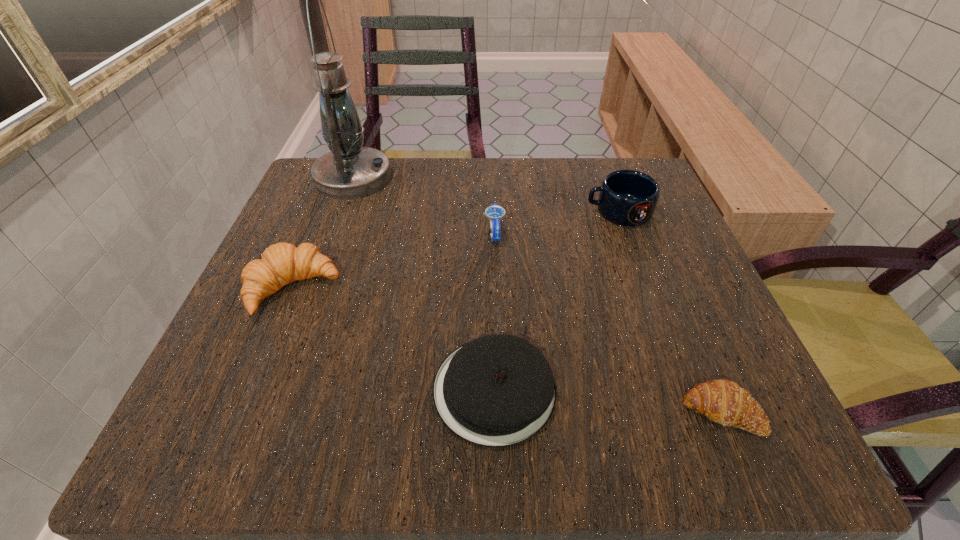
Locate an element on the screen. This screenshot has height=540, width=960. crescent roll located at the near edge is located at coordinates (722, 401).

Identify the location of oil lamp at the left edge. Image resolution: width=960 pixels, height=540 pixels. (350, 171).

The width and height of the screenshot is (960, 540). I want to click on crescent roll that is at the left edge, so click(x=282, y=263).

Where is `mug present at the right edge`? mug present at the right edge is located at coordinates point(627,197).

The height and width of the screenshot is (540, 960). What are the coordinates of `crescent roll that is at the right edge` in the screenshot? It's located at (722, 401).

The image size is (960, 540). Identify the location of object situated at the far left corner. (350, 171).

The width and height of the screenshot is (960, 540). Identify the location of object located at the far right corner. (627, 197).

This screenshot has height=540, width=960. In order to click on object that is at the near right corner in this screenshot , I will do `click(722, 401)`.

Where is `free point at the far edge`? The height and width of the screenshot is (540, 960). free point at the far edge is located at coordinates (557, 163).

Locate an element on the screen. Image resolution: width=960 pixels, height=540 pixels. vacant space at the near edge is located at coordinates (390, 403).